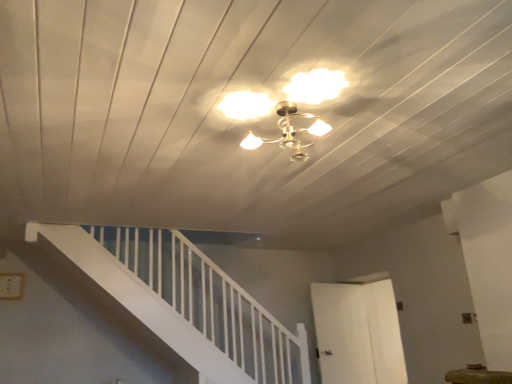
Measure the distance between white matte door at center and camera.

white matte door at center is 4.39 meters away from camera.

The image size is (512, 384). Identify the location of white matte door at center. (358, 333).

The image size is (512, 384). What do you see at coordinates (358, 333) in the screenshot? I see `white matte door at center` at bounding box center [358, 333].

Find the location of a particular element. The image size is (512, 384). white matte door at center is located at coordinates (358, 333).